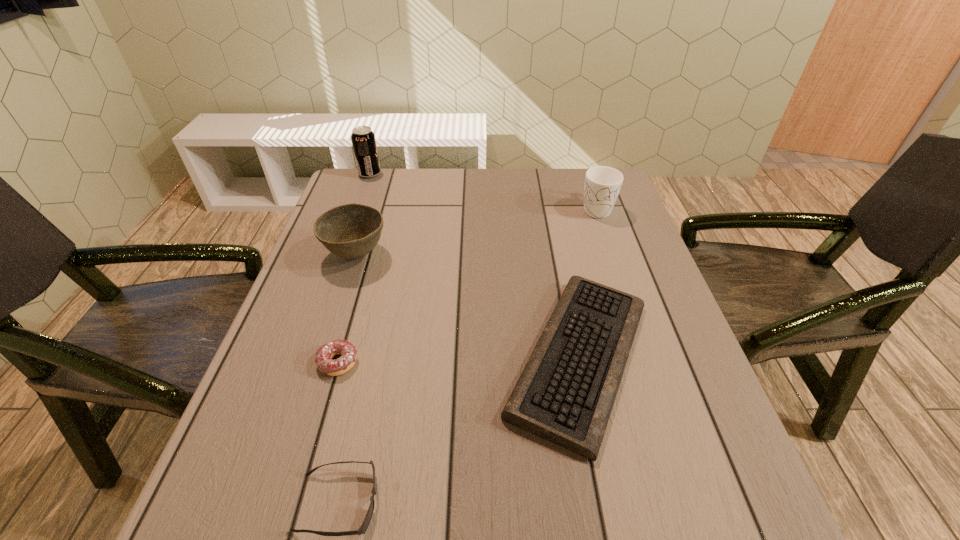
Image resolution: width=960 pixels, height=540 pixels. Find the location of `soda can`. soda can is located at coordinates (363, 139).

Where is `the tallest object`? the tallest object is located at coordinates (363, 139).

I want to click on the second farthest object, so click(602, 185).

In order to click on the third farthest object in this screenshot , I will do `click(351, 231)`.

At what (x,y) coordinates should I click in order to perform the action: click on computer keyboard. Please return your answer as a coordinate pair (x, y). Looking at the image, I should click on (565, 394).

You are a GUI agent. You are given a task and a screenshot of the screen. Output one action in this format:
    pyautogui.click(x=<x>, y=<y>)
    Task: Click on the doughnut
    The image size is (960, 540).
    Given the screenshot: What is the action you would take?
    pyautogui.click(x=324, y=355)

You are a GUI agent. You are given a task and a screenshot of the screen. Output one action in this format:
    pyautogui.click(x=<x>, y=<y>)
    Task: Click on the vacant space located 0.310m on the front of the tallest object
    The width and height of the screenshot is (960, 540).
    Given the screenshot: What is the action you would take?
    pyautogui.click(x=347, y=240)

Where is `vacant area situated on the side of the mug with the handle`? vacant area situated on the side of the mug with the handle is located at coordinates (607, 239).

Where is `free space located 0.130m on the back of the bowl`? The image size is (960, 540). free space located 0.130m on the back of the bowl is located at coordinates [x=372, y=209].

Find the location of a particular element. free spot located on the left of the computer keyboard is located at coordinates (454, 358).